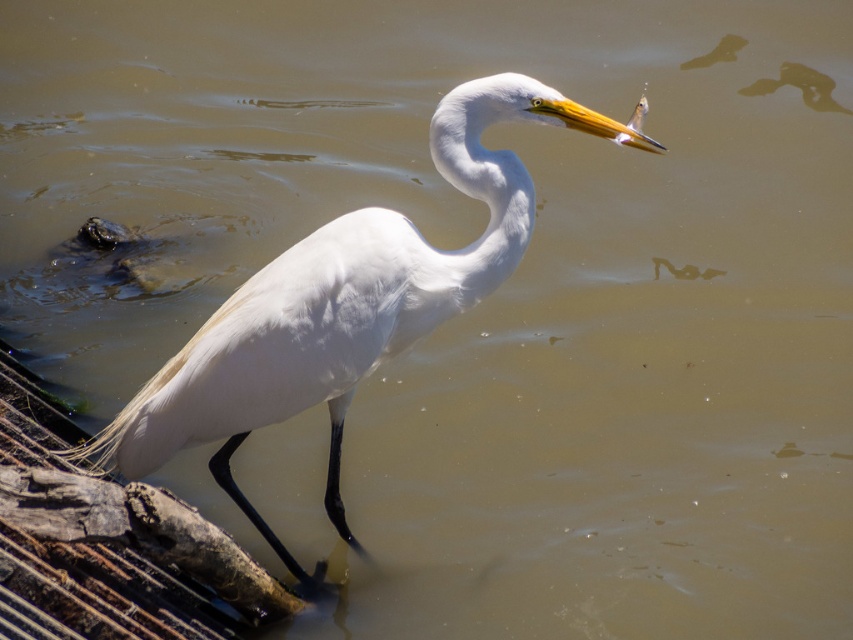
You are a wildlife photographer observing the scene. You want to capture a photo that emphasizes the height difference between the white feathered bird at center and the white smooth neck at center. Which object should you focus on to highlight this contrast?

The white feathered bird at center is taller than the white smooth neck at center, so focusing on the white feathered bird at center will best highlight the height contrast between the two.

You are a wildlife photographer aiming to capture a closeup of the white feathered bird at center and the white smooth neck at center in the image. If your camera can focus on objects within a 20 cm range, will you be able to capture both subjects clearly in the same shot?

The white feathered bird at center is 23.19 centimeters away from the white smooth neck at center, which is beyond the camera focus range of 20 cm. Therefore, you cannot capture both subjects clearly in the same shot.

You are a wildlife photographer aiming to capture a closeup of the white feathered bird at center. Your camera has a maximum focus range of 8 feet. Can you get a clear shot without moving closer?

The white feathered bird at center is 8.41 feet away from viewer. Since the camera can only focus up to 8 feet, you cannot get a clear shot without moving closer.